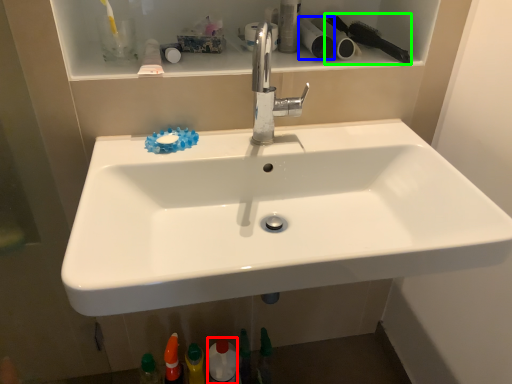
Question: Considering the real-world distances, which object is closest to mouthwash (highlighted by a red box)? toilet paper (highlighted by a blue box) or brush (highlighted by a green box).

Choices:
 (A) toilet paper
 (B) brush

Answer: (A)